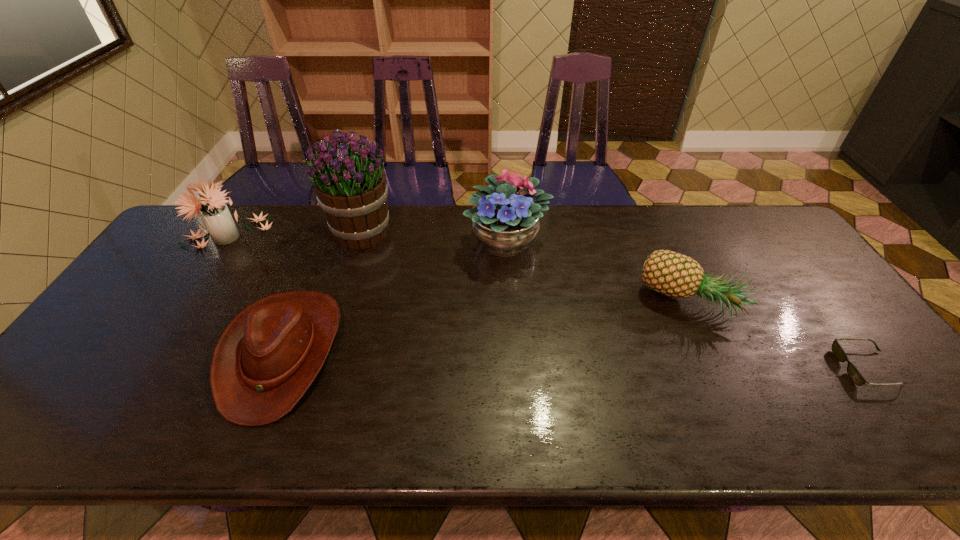
Identify the location of free location located on the right of the third object from right to left. (617, 241).

You are a GUI agent. You are given a task and a screenshot of the screen. Output one action in this format:
    pyautogui.click(x=<x>, y=<y>)
    Task: Click on the vacant space located on the front of the leftmost object
    The height and width of the screenshot is (540, 960).
    Given the screenshot: What is the action you would take?
    pyautogui.click(x=159, y=340)

At what (x,y) coordinates should I click in order to perform the action: click on vacant region located 0.300m on the back of the pineapple. Please return your answer as a coordinate pair (x, y). Looking at the image, I should click on [648, 215].

Identify the location of free space located on the front-facing side of the rightmost object. This screenshot has width=960, height=540. (701, 368).

The image size is (960, 540). In order to click on vacant space situated on the front-facing side of the rightmost object in this screenshot , I will do `click(713, 368)`.

Locate an element on the screen. The width and height of the screenshot is (960, 540). free space located 0.200m on the front-facing side of the rightmost object is located at coordinates (758, 368).

In order to click on object that is at the near edge in this screenshot , I will do `click(265, 360)`.

Identify the location of object at the left edge. (216, 216).

At what (x,y) coordinates should I click in order to perform the action: click on object that is at the right edge. Please return your answer as a coordinate pair (x, y). This screenshot has width=960, height=540. Looking at the image, I should click on (855, 375).

Image resolution: width=960 pixels, height=540 pixels. What are the coordinates of `object positioned at the far left corner` in the screenshot? It's located at (216, 216).